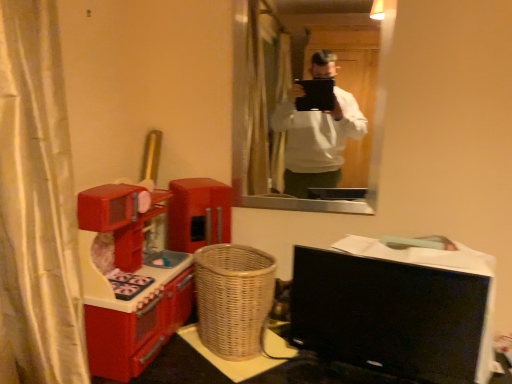
Question: Considering the relative sizes of matte glass mirror at upper center and woven brown basket at center in the image provided, is matte glass mirror at upper center taller than woven brown basket at center?

Choices:
 (A) no
 (B) yes

Answer: (B)

Question: Is matte glass mirror at upper center bigger than woven brown basket at center?

Choices:
 (A) no
 (B) yes

Answer: (A)

Question: Is matte glass mirror at upper center looking in the opposite direction of woven brown basket at center?

Choices:
 (A) no
 (B) yes

Answer: (A)

Question: From a real-world perspective, is matte glass mirror at upper center over woven brown basket at center?

Choices:
 (A) no
 (B) yes

Answer: (B)

Question: Is matte glass mirror at upper center not inside woven brown basket at center?

Choices:
 (A) no
 (B) yes

Answer: (B)

Question: Can you see matte glass mirror at upper center touching woven brown basket at center?

Choices:
 (A) yes
 (B) no

Answer: (B)

Question: Is shiny plastic toy kitchen at left far from matte glass mirror at upper center?

Choices:
 (A) yes
 (B) no

Answer: (B)

Question: Considering the relative positions of shiny plastic toy kitchen at left and matte glass mirror at upper center in the image provided, is shiny plastic toy kitchen at left to the right of matte glass mirror at upper center from the viewer's perspective?

Choices:
 (A) no
 (B) yes

Answer: (A)

Question: Can you confirm if shiny plastic toy kitchen at left is thinner than matte glass mirror at upper center?

Choices:
 (A) yes
 (B) no

Answer: (B)

Question: Does shiny plastic toy kitchen at left have a larger size compared to matte glass mirror at upper center?

Choices:
 (A) no
 (B) yes

Answer: (B)

Question: Is shiny plastic toy kitchen at left next to matte glass mirror at upper center and touching it?

Choices:
 (A) yes
 (B) no

Answer: (B)

Question: Does shiny plastic toy kitchen at left come behind matte glass mirror at upper center?

Choices:
 (A) no
 (B) yes

Answer: (A)

Question: Does woven wood table at lower center have a smaller size compared to shiny plastic toy kitchen at left?

Choices:
 (A) no
 (B) yes

Answer: (A)